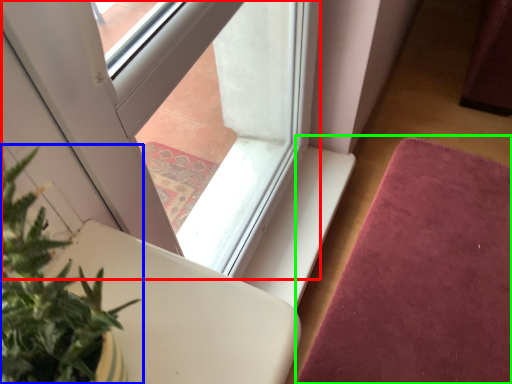
Question: Which object is positioned farthest from window (highlighted by a red box)? Select from houseplant (highlighted by a blue box) and mat (highlighted by a green box).

Choices:
 (A) houseplant
 (B) mat

Answer: (A)